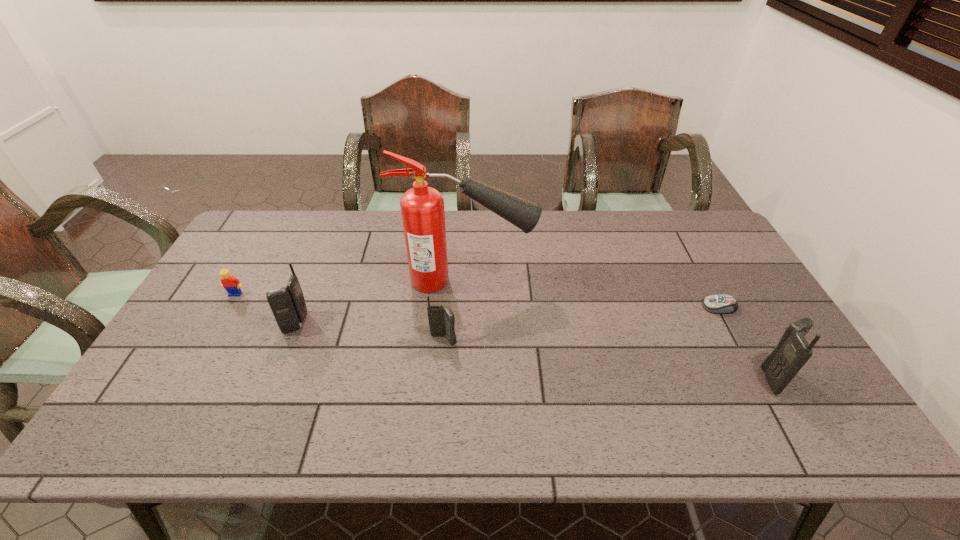
Where is `unoccupied position between the fifth shortest object and the fire extinguisher`? The height and width of the screenshot is (540, 960). unoccupied position between the fifth shortest object and the fire extinguisher is located at coordinates coord(620,329).

At what (x,y) coordinates should I click in order to perform the action: click on vacant region between the computer mouse and the third tallest object. Please return your answer as a coordinate pair (x, y). Image resolution: width=960 pixels, height=540 pixels. Looking at the image, I should click on (508, 315).

Where is `object that is the fifth closest to the second tallest object`? object that is the fifth closest to the second tallest object is located at coordinates (229, 282).

At what (x,y) coordinates should I click in order to perform the action: click on the third closest object to the tallest object. Please return your answer as a coordinate pair (x, y). This screenshot has height=540, width=960. Looking at the image, I should click on (229, 282).

This screenshot has height=540, width=960. In order to click on the second closest cellular telephone to the fourth tallest object in this screenshot , I will do `click(792, 352)`.

I want to click on cellular telephone identified as the second closest to the nearest object, so click(x=288, y=306).

At what (x,y) coordinates should I click in order to perform the action: click on free point that satisfies the following two spatial constraints: 1. on the wheel side of the computer mouse; 2. on the keyboard of the third shortest object. Please return your answer as a coordinate pair (x, y). Looking at the image, I should click on (737, 340).

At what (x,y) coordinates should I click in order to perform the action: click on vacant position in the image that satisfies the following two spatial constraints: 1. at the nozzle of the tallest object; 2. on the keyboard of the shortest cellular telephone. Please return your answer as a coordinate pair (x, y). Looking at the image, I should click on (464, 340).

Locate an element on the screen. This screenshot has height=540, width=960. free space that satisfies the following two spatial constraints: 1. on the wheel side of the shortest object; 2. on the keyboard of the second cellular telephone from right to left is located at coordinates (737, 340).

At what (x,y) coordinates should I click in order to perform the action: click on free location that satisfies the following two spatial constraints: 1. on the wheel side of the computer mouse; 2. on the keyboard of the second cellular telephone from left to right. Please return your answer as a coordinate pair (x, y). Looking at the image, I should click on coord(737,340).